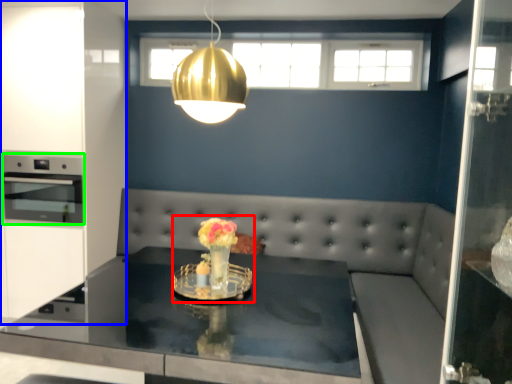
Question: Estimate the real-world distances between objects in this image. Which object is closer to floral arrangement (highlighted by a red box), cabinetry (highlighted by a blue box) or appliance (highlighted by a green box)?

Choices:
 (A) cabinetry
 (B) appliance

Answer: (B)